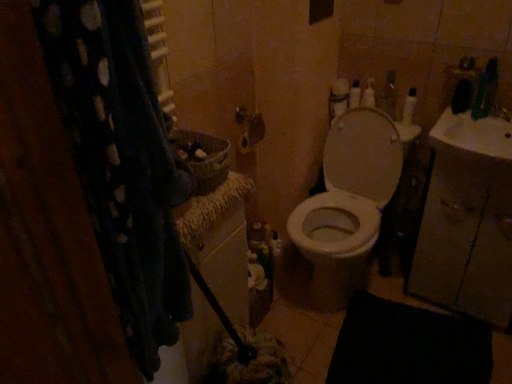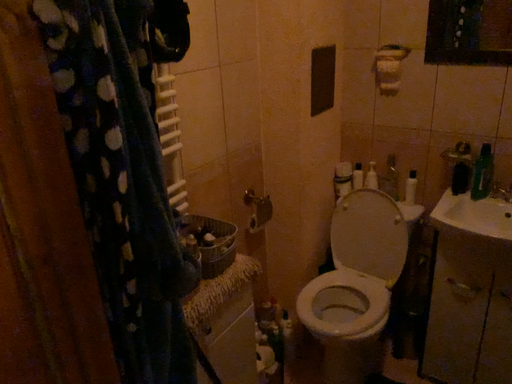
Question: How did the camera likely rotate when shooting the video?

Choices:
 (A) rotated downward
 (B) rotated upward

Answer: (B)